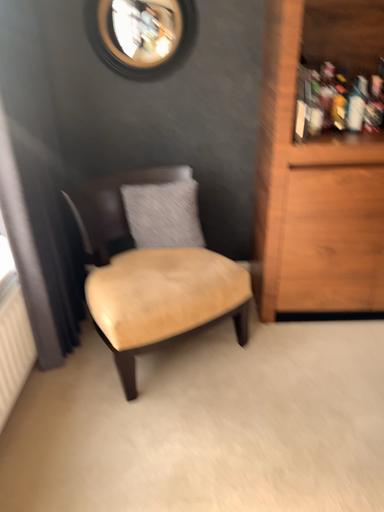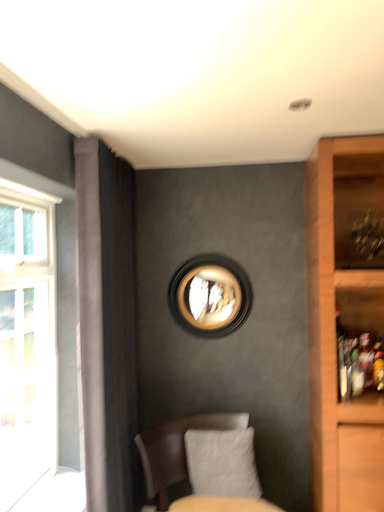
Question: How did the camera likely rotate when shooting the video?

Choices:
 (A) rotated left
 (B) rotated right

Answer: (A)